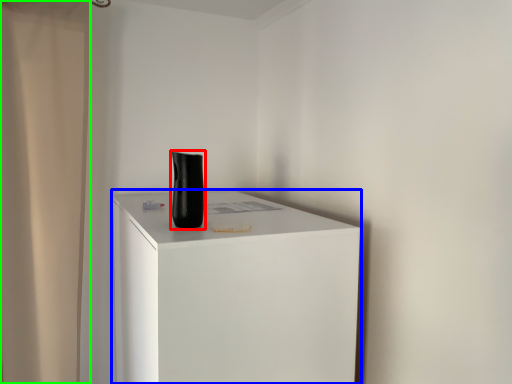
Question: Which object is positioned farthest from vase (highlighted by a red box)? Select from furniture (highlighted by a blue box) and shower curtain (highlighted by a green box).

Choices:
 (A) furniture
 (B) shower curtain

Answer: (B)